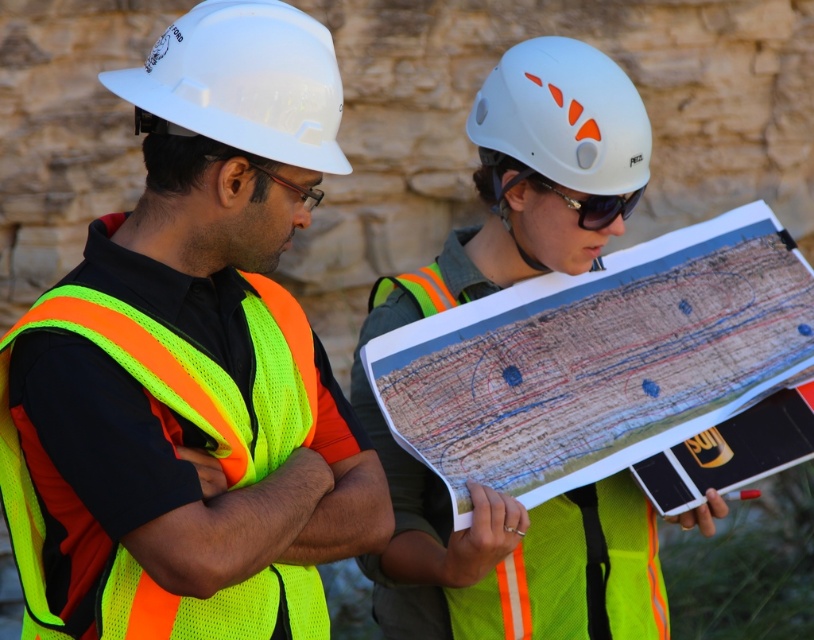
You are a safety inspector checking the equipment placement at a construction site. You notice the white hard hat at upper left and the white matte helmet at upper center. Which one is located more to the left?

The white hard hat at upper left is positioned on the left side of white matte helmet at upper center, so the white hard hat at upper left is more to the left.

You are a safety inspector and need to ensure all equipment meets size regulations. The white matte helmet at upper center and sunglasses at center must both be within the required dimensions. Given that the helmet must be wider than the sunglasses, does the current setup comply with the regulations?

The white matte helmet at upper center is wider than the sunglasses at center, so the current setup complies with the regulations.

You are a construction worker needing to retrieve a tool from the ground between the neon yellow mesh safety vest at left and the sunglasses at center. If your reach is 1.5 meters, can you comfortably pick it up without moving from your current position?

The distance between the neon yellow mesh safety vest at left and the sunglasses at center is 8.08 meters. Since your reach is only 1.5 meters, you cannot comfortably pick up the tool without moving closer.